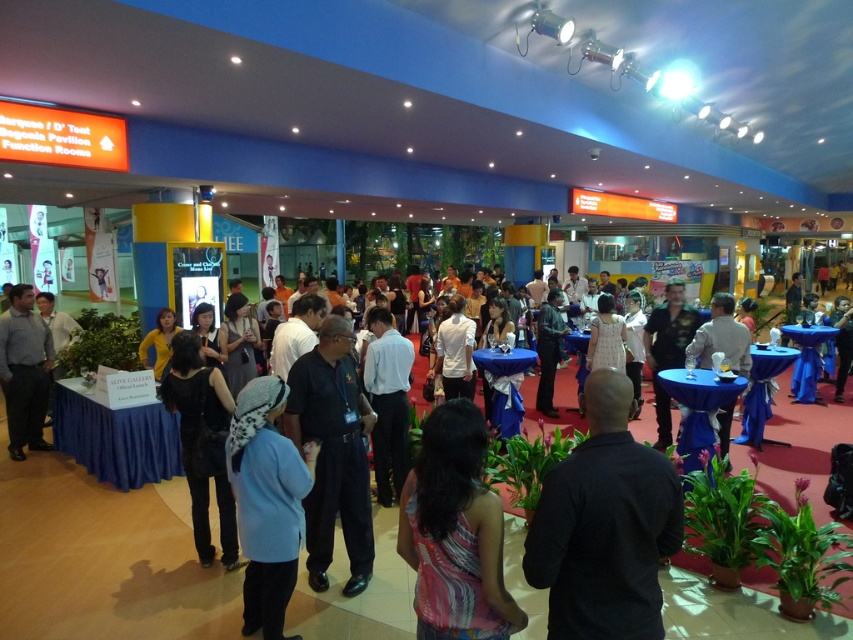
Question: Can you confirm if blue woolen hat at lower left is thinner than black matte dress at lower left?

Choices:
 (A) no
 (B) yes

Answer: (B)

Question: Is blue woolen hat at lower left to the right of matte gray shirt at left from the viewer's perspective?

Choices:
 (A) yes
 (B) no

Answer: (A)

Question: Which of the following is the closest to the observer?

Choices:
 (A) (186, 360)
 (B) (247, 410)
 (C) (606, 509)

Answer: (C)

Question: Can you confirm if black matte shirt at center is positioned to the right of blue woolen hat at lower left?

Choices:
 (A) no
 (B) yes

Answer: (B)

Question: Which point is closer to the camera taking this photo?

Choices:
 (A) (25, 426)
 (B) (471, 512)
 (C) (318, 580)

Answer: (B)

Question: Estimate the real-world distances between objects in this image. Which object is closer to the matte gray shirt at left?

Choices:
 (A) black matte dress at lower left
 (B) dark blue uniform at center
 (C) blue woolen hat at lower left

Answer: (A)